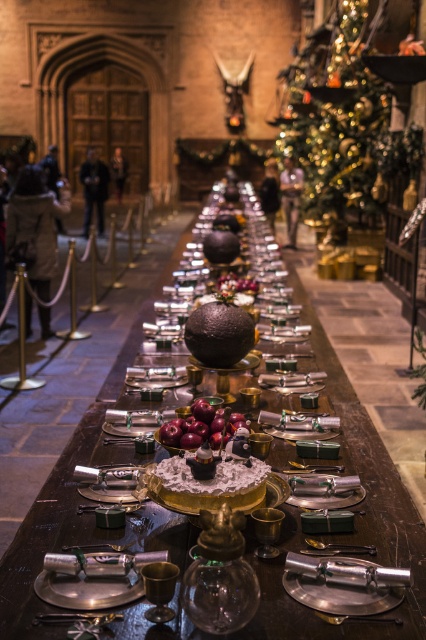
You are a guest at this festive dinner and want to place your napkin on the shiny silver table at center. However, you notice the shiny chocolate sphere at center might be in the way. From your perspective at the head of the table, which side should you reach to place the napkin?

The shiny silver table at center is to the left of the shiny chocolate sphere at center, so from your perspective at the head of the table, you should reach to the left side to place the napkin on the shiny silver table at center without the shiny chocolate sphere at center obstructing your path.

In the scene shown: You are a guest at this festive dinner and want to place your napkin on the table. If you are standing near the ornate wooden door at the far end of the room, which object is closer to you, the gold glittering christmas tree at upper right or the shiny red apples at center?

The shiny red apples at center are closer to you because the gold glittering christmas tree at upper right is positioned over them, meaning it is further away from the ornate wooden door at the far end of the room.

You are planning to place a large centerpiece on the shiny silver table at center. Considering the size of the gold glittering christmas tree at upper right, will the table have enough space to accommodate the centerpiece without it overlapping with the tree?

The shiny silver table at center is bigger than the gold glittering christmas tree at upper right, so there should be sufficient space to place the centerpiece without overlapping with the tree.